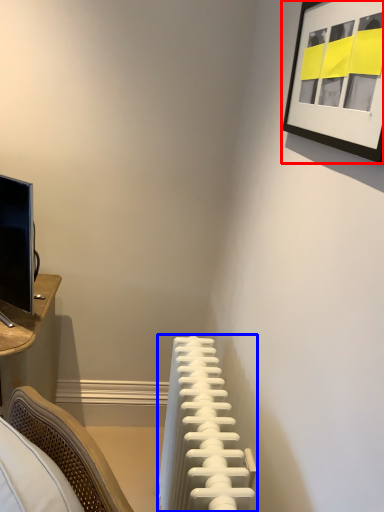
Question: Which object appears farthest to the camera in this image, picture frame (highlighted by a red box) or radiator (highlighted by a blue box)?

Choices:
 (A) picture frame
 (B) radiator

Answer: (B)